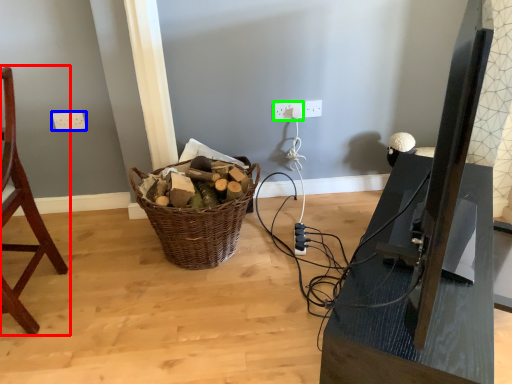
Question: Based on their relative distances, which object is farther from chair (highlighted by a red box)? Choose from electric outlet (highlighted by a blue box) and electric outlet (highlighted by a green box).

Choices:
 (A) electric outlet
 (B) electric outlet

Answer: (B)